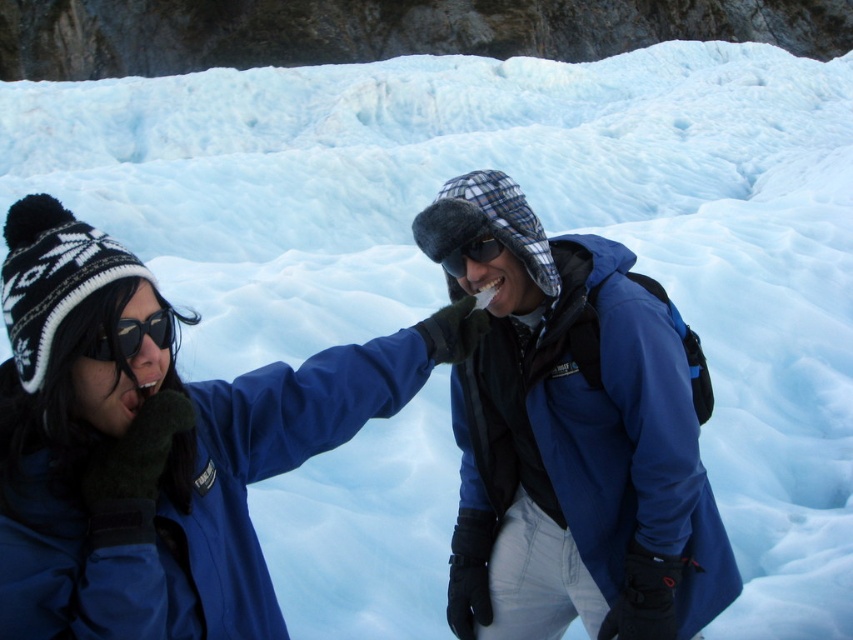
You are a photographer trying to capture the interaction between the two people in the snowy landscape. You notice two points of interest marked as point (x=445, y=196) and point (x=444, y=259). Which point should you focus on to ensure the subject is in sharp focus if you want to highlight the person closer to the camera?

Point (x=445, y=196) is closer to the viewer than point (x=444, y=259), so focusing on point (x=445, y=196) would ensure the subject closer to the camera is in sharp focus.

You are designing a display case for winter gear. The display case has a shelf that can only hold items with a width of 10 cm or less. You have the blue fleece jacket at center and the matte black goggles at left. Which item can safely fit on the shelf based on their widths?

The blue fleece jacket at center has a lesser width compared to matte black goggles at left, so the blue fleece jacket at center can safely fit on the shelf since it is narrower than the 10 cm limit.

You are a photographer trying to capture a candid shot of the two people in the snowy scene. You notice the blue fleece jacket at center and the matte black goggles at left. Based on their positions, which object would be easier to include in your photo if you want to focus on the upper part of the scene?

The blue fleece jacket at center is located above the matte black goggles at left, so it would be easier to include the blue fleece jacket at center in your photo if focusing on the upper part of the scene.